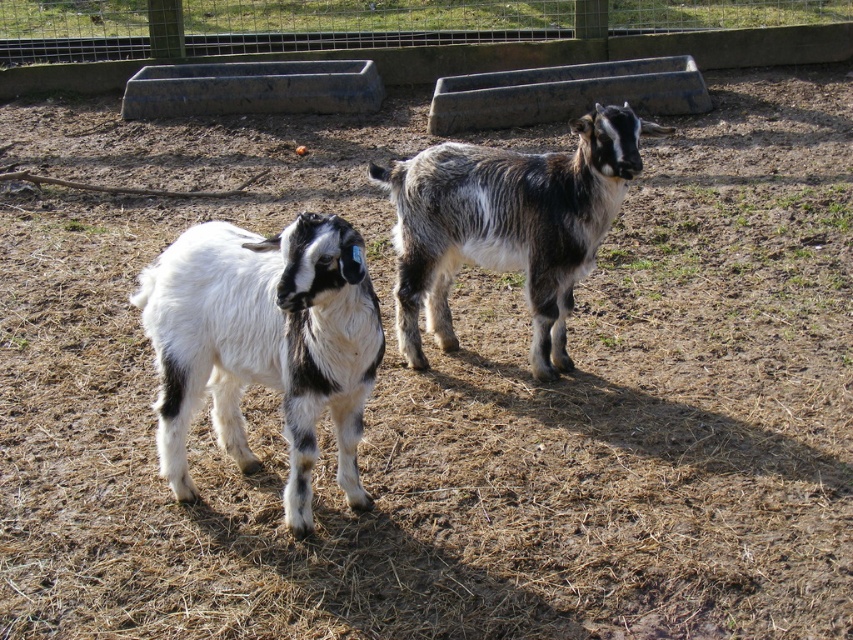
Is white woolen goat at center positioned at the back of speckled woolen goat at center?

No, it is in front of speckled woolen goat at center.

Is point (271, 248) positioned in front of point (444, 330)?

Yes, it is.

You are a GUI agent. You are given a task and a screenshot of the screen. Output one action in this format:
    pyautogui.click(x=<x>, y=<y>)
    Task: Click on the white woolen goat at center
    
    Given the screenshot: What is the action you would take?
    pyautogui.click(x=263, y=344)